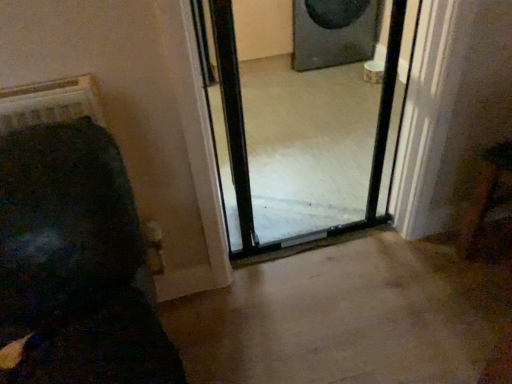
Question: Considering their positions, is black matte speaker at upper center located in front of or behind clear glass screen door at center?

Choices:
 (A) front
 (B) behind

Answer: (B)

Question: Is black matte speaker at upper center taller or shorter than clear glass screen door at center?

Choices:
 (A) short
 (B) tall

Answer: (A)

Question: Considering the positions of point (348, 41) and point (291, 137), is point (348, 41) closer or farther from the camera than point (291, 137)?

Choices:
 (A) farther
 (B) closer

Answer: (A)

Question: Is clear glass screen door at center inside the boundaries of black matte speaker at upper center, or outside?

Choices:
 (A) outside
 (B) inside

Answer: (A)

Question: In terms of width, does clear glass screen door at center look wider or thinner when compared to black matte speaker at upper center?

Choices:
 (A) thin
 (B) wide

Answer: (A)

Question: Considering their positions, is clear glass screen door at center located in front of or behind black matte speaker at upper center?

Choices:
 (A) front
 (B) behind

Answer: (A)

Question: Does point (368, 213) appear closer or farther from the camera than point (292, 9)?

Choices:
 (A) closer
 (B) farther

Answer: (A)